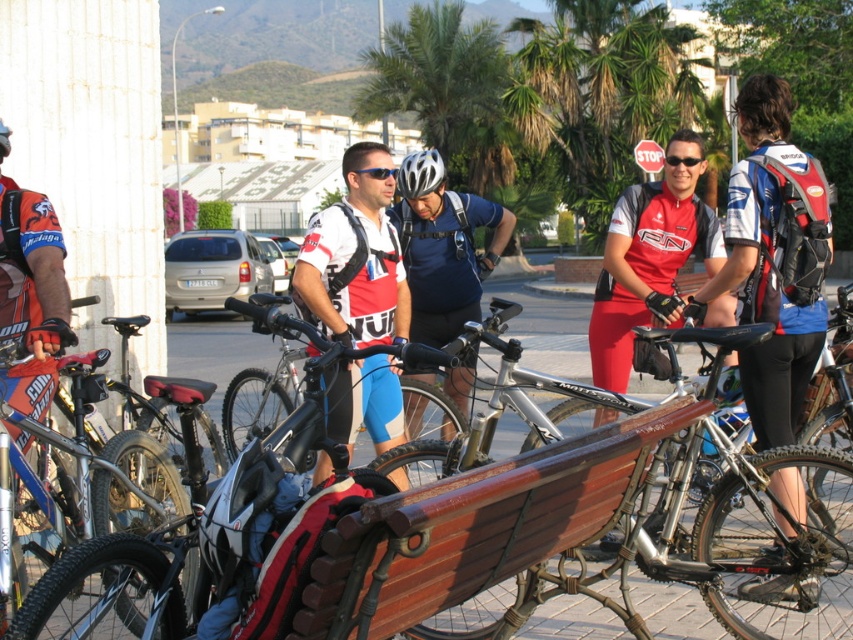
You are a photographer trying to capture a candid shot of the cyclists. You notice the white matte jersey at center and the silver metallic helmet at center. Which object should you focus on first if you want to photograph the one that is positioned more to the left?

The white matte jersey at center is positioned to the left of the silver metallic helmet at center, so you should focus on the white matte jersey at center first.

Where is the shiny blue helmet at center located in the image?

The shiny blue helmet at center is located at point coordinates of [444,246].